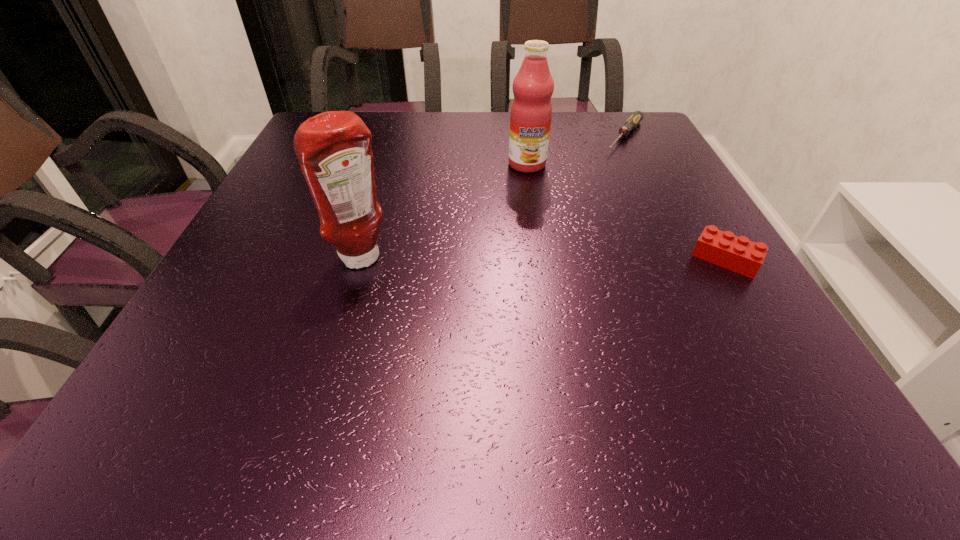
Find the location of a particular element. The image size is (960, 540). empty location between the Lego and the farthest object is located at coordinates (676, 198).

The height and width of the screenshot is (540, 960). Find the location of `free area in between the leftmost object and the fruit juice`. free area in between the leftmost object and the fruit juice is located at coordinates (445, 212).

Identify the location of free area in between the condiment and the fruit juice. The height and width of the screenshot is (540, 960). (445, 212).

Locate which object ranks second in proximity to the second shortest object. Please provide its 2D coordinates. Your answer should be formatted as a tuple, i.e. [(x, y)], where the tuple contains the x and y coordinates of a point satisfying the conditions above.

[(637, 116)]

This screenshot has width=960, height=540. What are the coordinates of `the closest object to the condiment` in the screenshot? It's located at (531, 111).